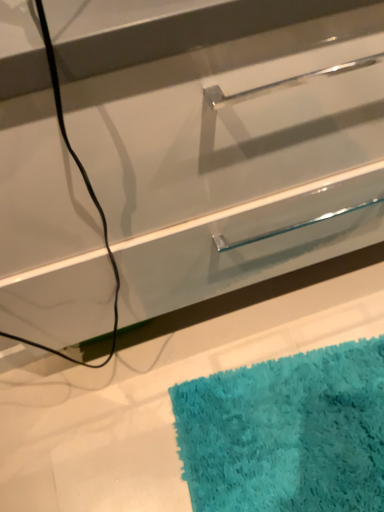
Locate an element on the screen. turquoise shaggy bath mat at lower right is located at coordinates (287, 433).

What do you see at coordinates (287, 433) in the screenshot? I see `turquoise shaggy bath mat at lower right` at bounding box center [287, 433].

Describe the element at coordinates (236, 158) in the screenshot. The image size is (384, 512). I see `clear glass drawer at center` at that location.

Measure the distance between point (169, 148) and camera.

The depth of point (169, 148) is 19.84 inches.

This screenshot has height=512, width=384. Find the location of `clear glass drawer at center`. clear glass drawer at center is located at coordinates (236, 158).

Image resolution: width=384 pixels, height=512 pixels. I want to click on turquoise shaggy bath mat at lower right, so click(x=287, y=433).

Which is more to the left, turquoise shaggy bath mat at lower right or clear glass drawer at center?

clear glass drawer at center is more to the left.

Which object is further away from the camera taking this photo, turquoise shaggy bath mat at lower right or clear glass drawer at center?

turquoise shaggy bath mat at lower right is further away from the camera.

Looking at this image, which is farther from the camera, (x=241, y=374) or (x=357, y=81)?

The point (x=241, y=374) is farther.

From the image's perspective, is turquoise shaggy bath mat at lower right positioned above or below clear glass drawer at center?

From the image's perspective, turquoise shaggy bath mat at lower right appears below clear glass drawer at center.

From a real-world perspective, between turquoise shaggy bath mat at lower right and clear glass drawer at center, who is vertically higher?

clear glass drawer at center is physically above.

Considering the relative sizes of turquoise shaggy bath mat at lower right and clear glass drawer at center in the image provided, is turquoise shaggy bath mat at lower right thinner than clear glass drawer at center?

Incorrect, the width of turquoise shaggy bath mat at lower right is not less than that of clear glass drawer at center.

Is turquoise shaggy bath mat at lower right shorter than clear glass drawer at center?

Correct, turquoise shaggy bath mat at lower right is not as tall as clear glass drawer at center.

Who is bigger, turquoise shaggy bath mat at lower right or clear glass drawer at center?

With larger size is clear glass drawer at center.

Is turquoise shaggy bath mat at lower right not inside clear glass drawer at center?

Yes, turquoise shaggy bath mat at lower right is outside of clear glass drawer at center.

Is turquoise shaggy bath mat at lower right not close to clear glass drawer at center?

turquoise shaggy bath mat at lower right is actually quite close to clear glass drawer at center.

Is turquoise shaggy bath mat at lower right facing away from clear glass drawer at center?

That's not correct — turquoise shaggy bath mat at lower right is not looking away from clear glass drawer at center.

How far apart are turquoise shaggy bath mat at lower right and clear glass drawer at center?

turquoise shaggy bath mat at lower right is 16.64 inches away from clear glass drawer at center.

Where is `drawer above the turquoise shaggy bath mat at lower right (from a real-world perspective)`? Image resolution: width=384 pixels, height=512 pixels. drawer above the turquoise shaggy bath mat at lower right (from a real-world perspective) is located at coordinates (236, 158).

Is clear glass drawer at center at the left side of turquoise shaggy bath mat at lower right?

Indeed, clear glass drawer at center is positioned on the left side of turquoise shaggy bath mat at lower right.

Which object is closer to the camera, clear glass drawer at center or turquoise shaggy bath mat at lower right?

clear glass drawer at center is closer to the camera.

Is point (170, 274) positioned behind point (186, 433)?

That is False.

From the image's perspective, is clear glass drawer at center over turquoise shaggy bath mat at lower right?

Yes, from the image's perspective, clear glass drawer at center is above turquoise shaggy bath mat at lower right.

From a real-world perspective, is clear glass drawer at center positioned under turquoise shaggy bath mat at lower right based on gravity?

Actually, clear glass drawer at center is physically above turquoise shaggy bath mat at lower right in the real world.

Is clear glass drawer at center wider or thinner than turquoise shaggy bath mat at lower right?

clear glass drawer at center is thinner than turquoise shaggy bath mat at lower right.

Between clear glass drawer at center and turquoise shaggy bath mat at lower right, which one has more height?

clear glass drawer at center is taller.

Who is bigger, clear glass drawer at center or turquoise shaggy bath mat at lower right?

clear glass drawer at center.

In the scene shown: Would you say clear glass drawer at center contains turquoise shaggy bath mat at lower right?

No.

Are clear glass drawer at center and turquoise shaggy bath mat at lower right making contact?

No, clear glass drawer at center is not with turquoise shaggy bath mat at lower right.

Is clear glass drawer at center looking in the opposite direction of turquoise shaggy bath mat at lower right?

clear glass drawer at center is not turned away from turquoise shaggy bath mat at lower right.

Can you tell me how much clear glass drawer at center and turquoise shaggy bath mat at lower right differ in facing direction?

clear glass drawer at center and turquoise shaggy bath mat at lower right are facing 99 degrees away from each other.

This screenshot has width=384, height=512. Identify the location of bath mat lying on the right of clear glass drawer at center. (287, 433).

I want to click on drawer located above the turquoise shaggy bath mat at lower right (from the image's perspective), so click(x=236, y=158).

The width and height of the screenshot is (384, 512). In order to click on drawer in front of the turquoise shaggy bath mat at lower right in this screenshot , I will do `click(236, 158)`.